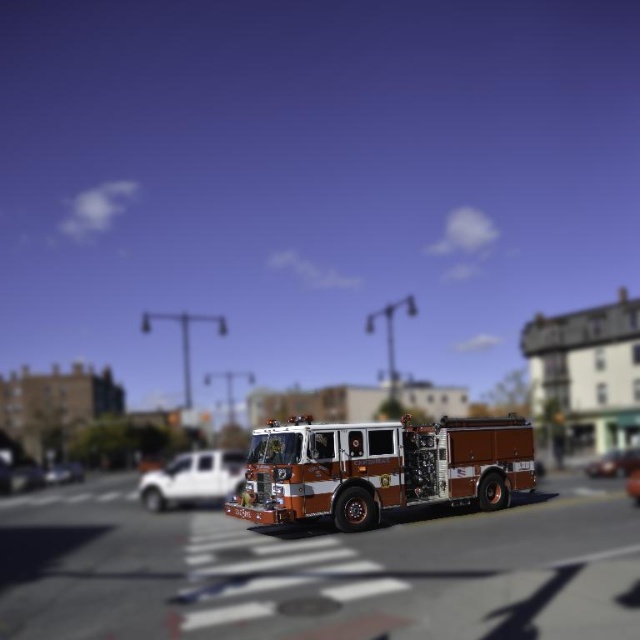
Question: Which of the following is the closest to the observer?

Choices:
 (A) shiny silver car at center
 (B) metallic silver car at center
 (C) shiny metallic fire truck at center
 (D) shiny red fire truck at center

Answer: (C)

Question: Is shiny red fire truck at center in front of metallic silver fire truck at center?

Choices:
 (A) no
 (B) yes

Answer: (B)

Question: Is shiny metallic fire truck at center to the left of shiny orange car at center from the viewer's perspective?

Choices:
 (A) yes
 (B) no

Answer: (A)

Question: Can you confirm if shiny metallic fire truck at center is thinner than shiny red fire truck at center?

Choices:
 (A) no
 (B) yes

Answer: (A)

Question: Considering the real-world distances, which object is closest to the shiny red fire truck at center?

Choices:
 (A) metallic silver car at center
 (B) metallic silver fire truck at center

Answer: (B)

Question: Which object is the closest to the shiny metallic fire truck at center?

Choices:
 (A) shiny red fire truck at center
 (B) shiny silver car at center

Answer: (A)